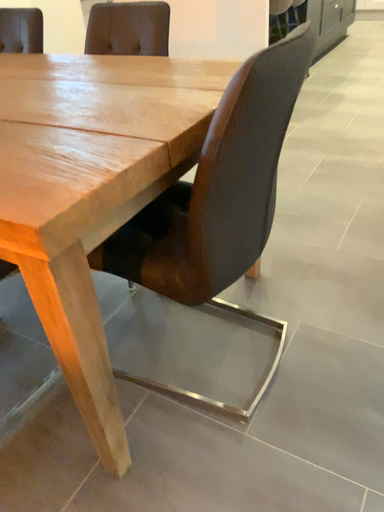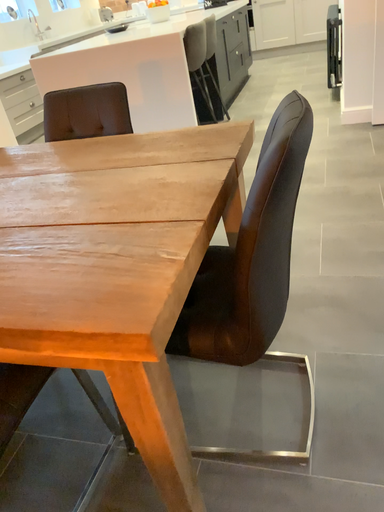
Question: Which way did the camera rotate in the video?

Choices:
 (A) rotated downward
 (B) rotated upward

Answer: (B)